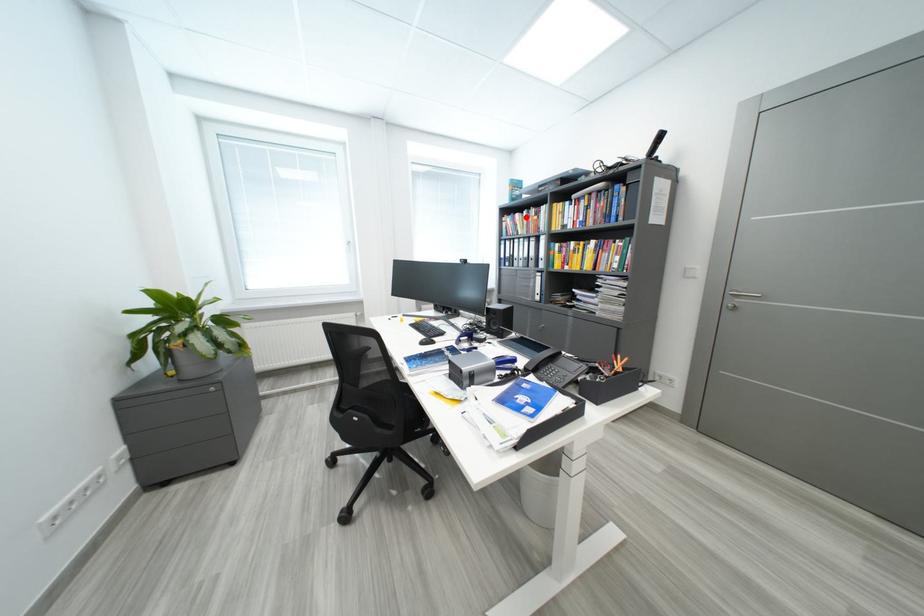
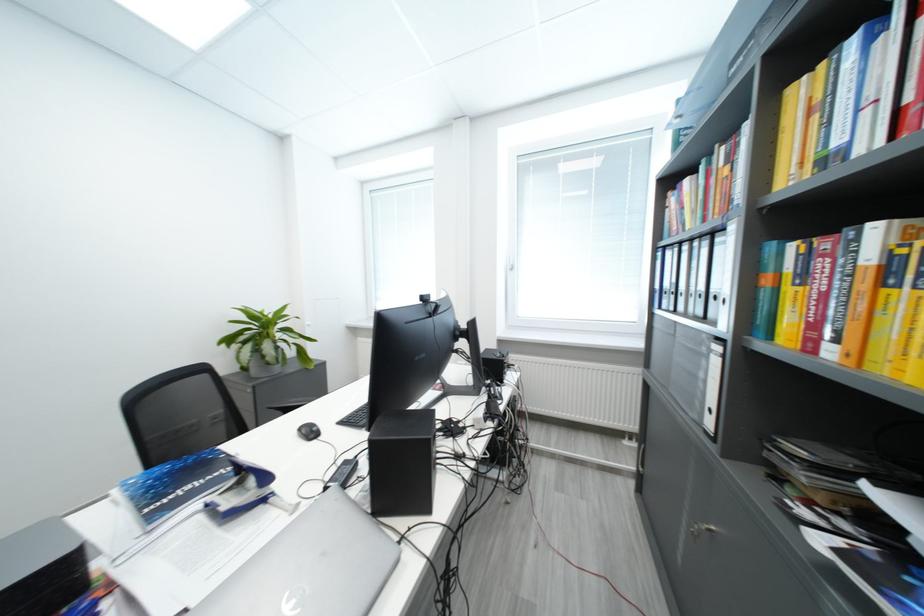
Question: I am providing you with two images of the same scene from different viewpoints. Image1 has a red point marked. In image2, the corresponding 3D location appears at what relative position? Reply with the corresponding letter.

Choices:
 (A) Closer
 (B) Farther

Answer: (B)